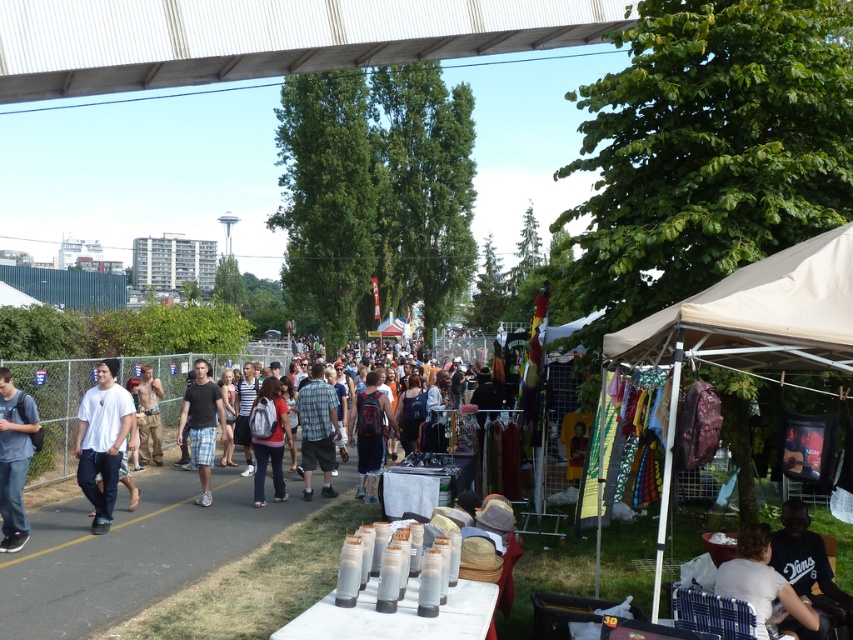
Question: Which point is farther to the camera?

Choices:
 (A) matte white backpack at center
 (B) denim shorts at center

Answer: (B)

Question: Among these objects, which one is nearest to the camera?

Choices:
 (A) tan cotton shorts at left
 (B) plaid fabric shirt at center
 (C) denim shorts at center
 (D) beige fabric canopy at right

Answer: (D)

Question: Is white fabric shirt at lower right to the right of denim jeans at left from the viewer's perspective?

Choices:
 (A) yes
 (B) no

Answer: (A)

Question: Is the position of denim jeans at left more distant than that of plaid fabric shirt at center?

Choices:
 (A) yes
 (B) no

Answer: (B)

Question: Which of the following is the farthest from the observer?

Choices:
 (A) pos(195,410)
 (B) pos(10,451)

Answer: (A)

Question: Is beige fabric tent at right smaller than matte white backpack at center?

Choices:
 (A) yes
 (B) no

Answer: (B)